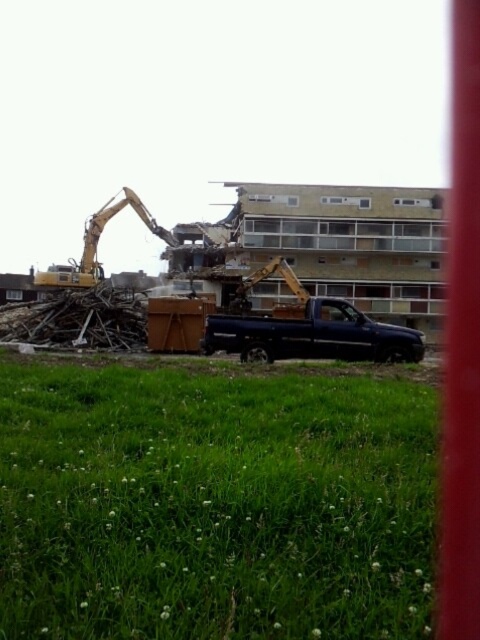
Who is more forward, (126, 426) or (317, 348)?

Positioned in front is point (126, 426).

Measure the distance between green grassy field at lower center and camera.

green grassy field at lower center is 3.76 feet from camera.

What are the coordinates of `green grassy field at lower center` in the screenshot? It's located at (214, 502).

Where is `green grassy field at lower center`? The height and width of the screenshot is (640, 480). green grassy field at lower center is located at coordinates (214, 502).

Is point (389, 356) less distant than point (136, 195)?

Yes.

Which is more to the left, matte black truck at center or yellow metallic excavator at left?

yellow metallic excavator at left is more to the left.

Between point (354, 356) and point (156, 221), which one is positioned in front?

Positioned in front is point (354, 356).

The height and width of the screenshot is (640, 480). I want to click on matte black truck at center, so click(x=312, y=336).

Is green grassy field at lower center to the left of yellow metallic excavator at left from the viewer's perspective?

In fact, green grassy field at lower center is to the right of yellow metallic excavator at left.

The height and width of the screenshot is (640, 480). I want to click on green grassy field at lower center, so click(x=214, y=502).